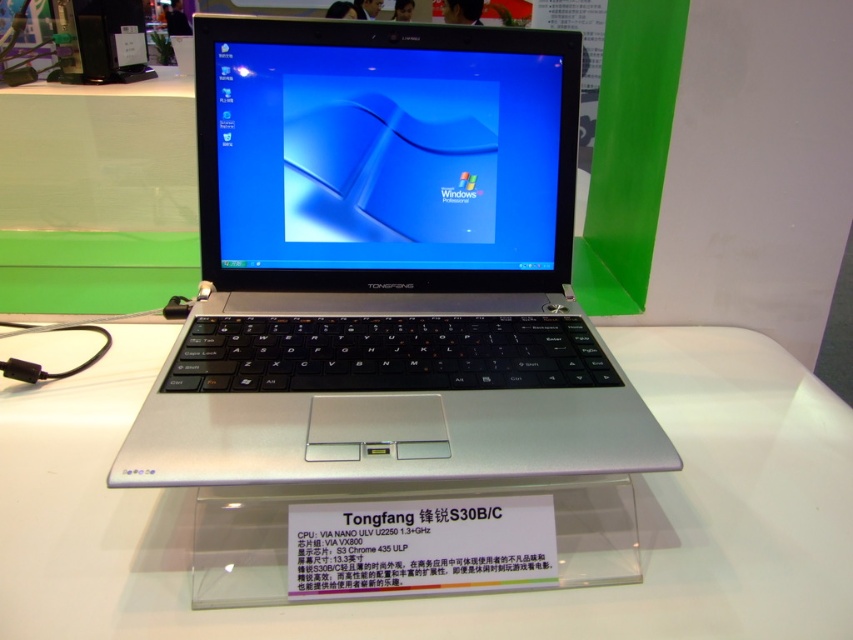
Does silver metallic laptop at center appear over transparent glass display at center?

Indeed, silver metallic laptop at center is positioned over transparent glass display at center.

Between silver metallic laptop at center and transparent glass display at center, which one has more height?

silver metallic laptop at center is taller.

Where is `silver metallic laptop at center`? silver metallic laptop at center is located at coordinates (386, 266).

Does silver metallic table at center have a greater width compared to transparent glass display at center?

Correct, the width of silver metallic table at center exceeds that of transparent glass display at center.

Find the location of a particular element. silver metallic table at center is located at coordinates (469, 595).

Is point (170, 586) positioned behind point (416, 554)?

No, it is not.

Find the location of `silver metallic table at center`. silver metallic table at center is located at coordinates (469, 595).

Is silver metallic laptop at center positioned at the back of silver metallic table at center?

No, it is in front of silver metallic table at center.

Can you confirm if silver metallic laptop at center is positioned to the right of silver metallic table at center?

Incorrect, silver metallic laptop at center is not on the right side of silver metallic table at center.

Identify the location of silver metallic laptop at center. pyautogui.click(x=386, y=266).

Locate an element on the screen. Image resolution: width=853 pixels, height=640 pixels. silver metallic laptop at center is located at coordinates (386, 266).